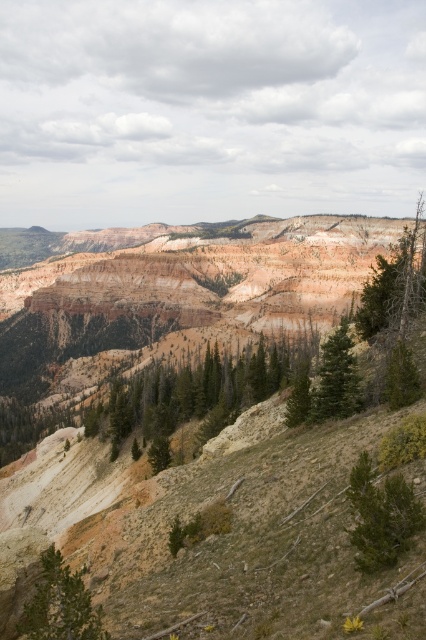
You are standing at the origin point of the coordinate system in this mountainous landscape. You want to walk towards the green textured tree at center. What direction should you head in?

The green textured tree at center is located at coordinate point 0.614 on the x axis and 0.460 on the y axis. Since you are at the origin, you should move in the positive x and positive y direction to reach it.

You are an environmental scientist assessing the vegetation in this mountainous area. You notice two green textured pine at lower right and green textured tree at right. Which of these two plants is more likely to be a mature tree based on their size?

The green textured tree at right is more likely to be a mature tree since it is larger than the green textured pine at lower right.